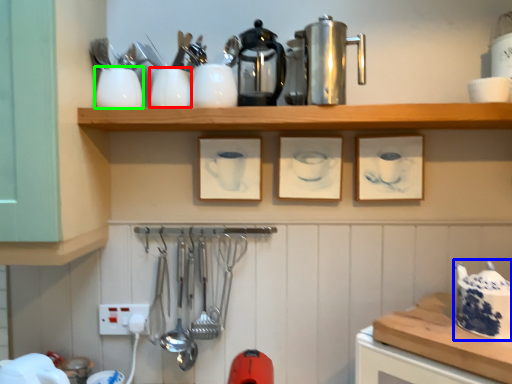
Question: Which object is positioned farthest from tableware (highlighted by a red box)? Select from tea pot (highlighted by a blue box) and tableware (highlighted by a green box).

Choices:
 (A) tea pot
 (B) tableware

Answer: (A)